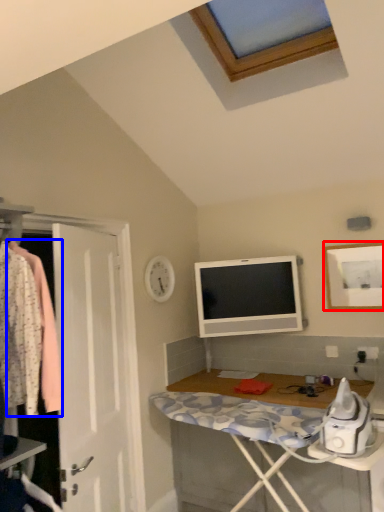
Question: Which of the following is the farthest to the observer, picture frame (highlighted by a red box) or clothing (highlighted by a blue box)?

Choices:
 (A) picture frame
 (B) clothing

Answer: (A)